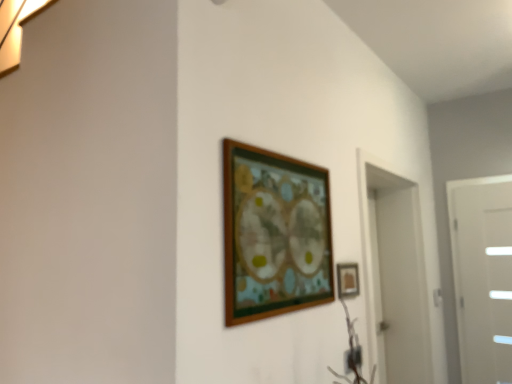
Question: Does white glossy door at right lie behind matte gold picture frame at center-right, the second picture frame from the left?

Choices:
 (A) no
 (B) yes

Answer: (B)

Question: Considering the relative sizes of white glossy door at right and matte gold picture frame at center-right, positioned as the 1th picture frame in back-to-front order, in the image provided, is white glossy door at right thinner than matte gold picture frame at center-right, positioned as the 1th picture frame in back-to-front order,?

Choices:
 (A) yes
 (B) no

Answer: (B)

Question: Are white glossy door at right and matte gold picture frame at center-right, positioned as the 1th picture frame in back-to-front order, far apart?

Choices:
 (A) no
 (B) yes

Answer: (B)

Question: Considering the relative sizes of white glossy door at right and matte gold picture frame at center-right, marked as the second picture frame in a front-to-back arrangement, in the image provided, is white glossy door at right taller than matte gold picture frame at center-right, marked as the second picture frame in a front-to-back arrangement,?

Choices:
 (A) yes
 (B) no

Answer: (A)

Question: From a real-world perspective, is white glossy door at right under matte gold picture frame at center-right, acting as the first picture frame starting from the right?

Choices:
 (A) yes
 (B) no

Answer: (A)

Question: Does white glossy door at right have a lesser height compared to matte gold picture frame at center-right, the second picture frame from the left?

Choices:
 (A) no
 (B) yes

Answer: (A)

Question: Can you confirm if white glossy door at right is bigger than wooden picture frame at center, which appears as the first picture frame when viewed from the front?

Choices:
 (A) yes
 (B) no

Answer: (A)

Question: Is white glossy door at right in front of wooden picture frame at center, the 1th picture frame in the left-to-right sequence?

Choices:
 (A) no
 (B) yes

Answer: (A)

Question: From a real-world perspective, is white glossy door at right on wooden picture frame at center, the 1th picture frame in the left-to-right sequence?

Choices:
 (A) yes
 (B) no

Answer: (B)

Question: Can you confirm if white glossy door at right is taller than wooden picture frame at center, the 1th picture frame in the left-to-right sequence?

Choices:
 (A) no
 (B) yes

Answer: (B)

Question: Is white glossy door at right at the left side of wooden picture frame at center, which appears as the second picture frame when viewed from the back?

Choices:
 (A) yes
 (B) no

Answer: (B)

Question: Does white glossy door at right have a lesser width compared to wooden picture frame at center, which appears as the second picture frame when viewed from the back?

Choices:
 (A) no
 (B) yes

Answer: (A)

Question: Does wooden picture frame at center, which appears as the second picture frame when viewed from the back, have a greater height compared to white glossy door at right?

Choices:
 (A) no
 (B) yes

Answer: (A)